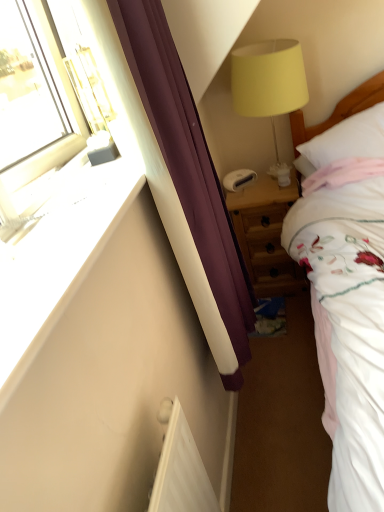
Question: Would you say purple fabric curtain at left is to the left or to the right of white smooth wall at left in the picture?

Choices:
 (A) right
 (B) left

Answer: (A)

Question: In terms of height, does purple fabric curtain at left look taller or shorter compared to white smooth wall at left?

Choices:
 (A) tall
 (B) short

Answer: (A)

Question: Which object is the closest to the purple fabric curtain at left?

Choices:
 (A) white smooth wall at left
 (B) white soft pillow at right
 (C) yellow fabric lampshade at upper right
 (D) wooden nightstand at center

Answer: (A)

Question: Which of these objects is positioned closest to the white smooth wall at left?

Choices:
 (A) white soft pillow at right
 (B) purple fabric curtain at left
 (C) yellow fabric lampshade at upper right
 (D) wooden nightstand at center

Answer: (B)